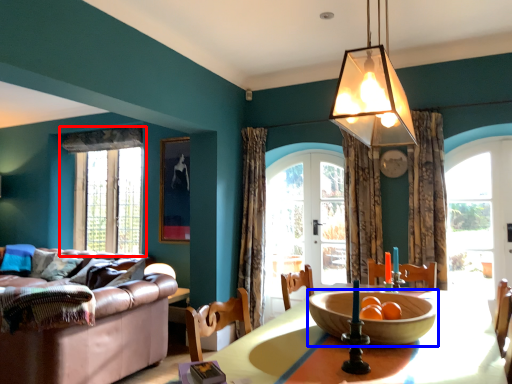
Question: Which object appears farthest to the camera in this image, window (highlighted by a red box) or bowl (highlighted by a blue box)?

Choices:
 (A) window
 (B) bowl

Answer: (A)